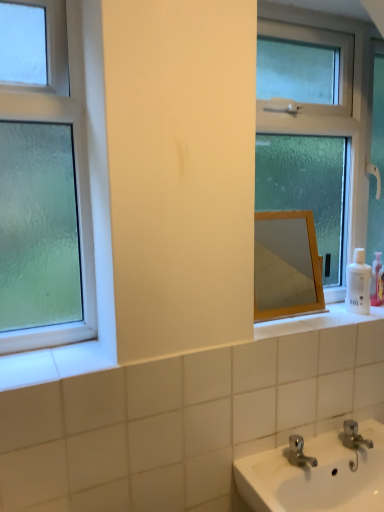
Question: Would you say green frosted glass window at left, which is the second window in back-to-front order, is to the left or to the right of white plastic bottle at right in the picture?

Choices:
 (A) left
 (B) right

Answer: (A)

Question: Is green frosted glass window at left, which is the second window in back-to-front order, inside the boundaries of white plastic bottle at right, or outside?

Choices:
 (A) inside
 (B) outside

Answer: (B)

Question: Which of these objects is positioned farthest from the wooden mirror at center?

Choices:
 (A) clear glass window at center, which ranks as the first window in right-to-left order
 (B) white plastic bottle at right
 (C) green frosted glass window at left, the 1th window viewed from the left

Answer: (C)

Question: Based on their relative distances, which object is farther from the green frosted glass window at left, which is the second window in back-to-front order?

Choices:
 (A) clear glass window at center, placed as the 2th window when sorted from left to right
 (B) wooden mirror at center
 (C) white plastic bottle at right

Answer: (B)